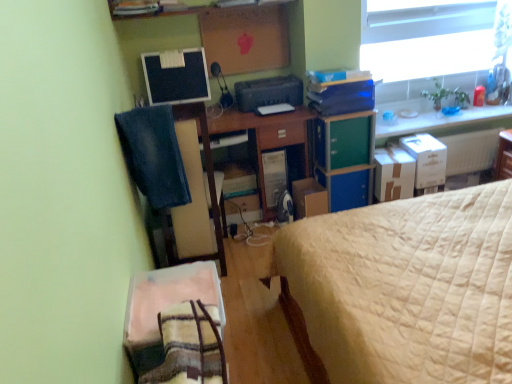
Locate an element on the screen. The image size is (512, 384). free space above white cardboard box at upper right, which ranks as the 3th cardboard box in left-to-right order (from a real-world perspective) is located at coordinates (424, 139).